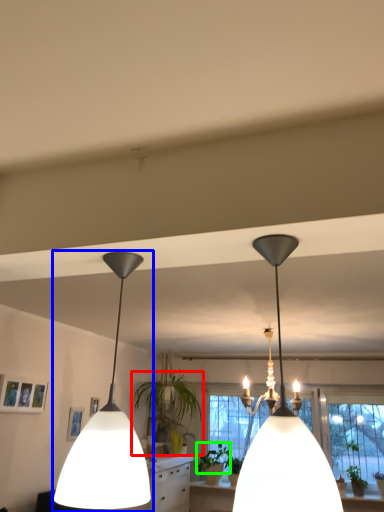
Question: Which is nearer to the houseplant (highlighted by a red box)? lamp (highlighted by a blue box) or plant (highlighted by a green box).

Choices:
 (A) lamp
 (B) plant

Answer: (B)